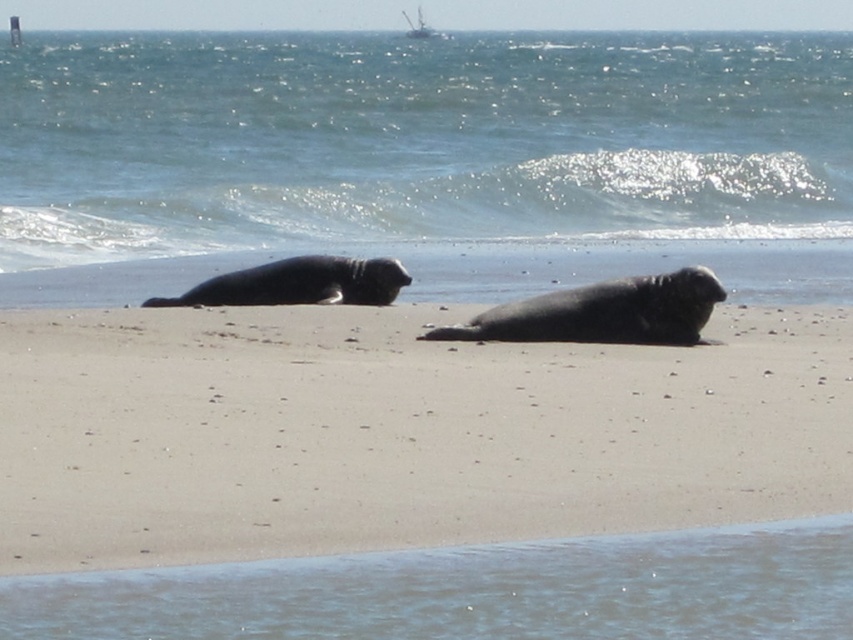
Who is positioned more to the right, blue water at upper center or gray fur seal at center?

Positioned to the right is gray fur seal at center.

Who is more forward, (618, 154) or (602, 288)?

Point (602, 288) is in front.

Image resolution: width=853 pixels, height=640 pixels. Find the location of `blue water at upper center`. blue water at upper center is located at coordinates (416, 140).

Does smooth sand at center have a lesser width compared to gray fur seal at center?

Indeed, smooth sand at center has a lesser width compared to gray fur seal at center.

Which is in front, point (512, 403) or point (672, 298)?

Point (512, 403) is more forward.

Where is `smooth sand at center`? The width and height of the screenshot is (853, 640). smooth sand at center is located at coordinates (398, 433).

Which is in front, point (387, 429) or point (633, 234)?

Point (387, 429)

Is point (502, 369) positioned before point (135, 122)?

Yes, it is.

I want to click on smooth sand at center, so click(398, 433).